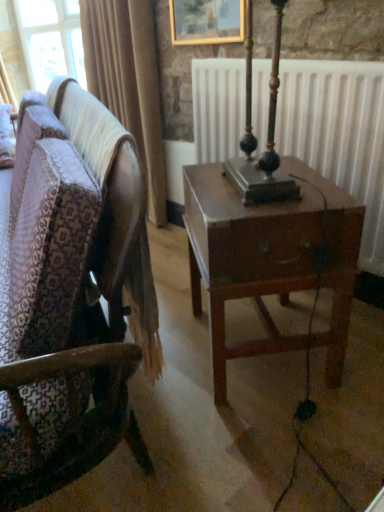
Question: Can you confirm if wooden chair at center is shorter than gold-framed painting at upper center?

Choices:
 (A) no
 (B) yes

Answer: (A)

Question: Is wooden chair at center at the left side of gold-framed painting at upper center?

Choices:
 (A) no
 (B) yes

Answer: (B)

Question: Considering the relative sizes of wooden chair at center and gold-framed painting at upper center in the image provided, is wooden chair at center bigger than gold-framed painting at upper center?

Choices:
 (A) yes
 (B) no

Answer: (A)

Question: Does wooden chair at center turn towards gold-framed painting at upper center?

Choices:
 (A) yes
 (B) no

Answer: (B)

Question: Does wooden chair at center come behind gold-framed painting at upper center?

Choices:
 (A) yes
 (B) no

Answer: (B)

Question: From the image's perspective, relative to wooden chair at center, is white matte radiator at center above or below?

Choices:
 (A) below
 (B) above

Answer: (B)

Question: In terms of width, does white matte radiator at center look wider or thinner when compared to wooden chair at center?

Choices:
 (A) thin
 (B) wide

Answer: (A)

Question: In terms of size, does white matte radiator at center appear bigger or smaller than wooden chair at center?

Choices:
 (A) small
 (B) big

Answer: (A)

Question: Would you say white matte radiator at center is to the left or to the right of wooden chair at center in the picture?

Choices:
 (A) right
 (B) left

Answer: (A)

Question: In terms of height, does gold-framed painting at upper center look taller or shorter compared to wooden chair at center?

Choices:
 (A) tall
 (B) short

Answer: (B)

Question: From a real-world perspective, is gold-framed painting at upper center above or below wooden chair at center?

Choices:
 (A) above
 (B) below

Answer: (A)

Question: Is gold-framed painting at upper center inside or outside of wooden chair at center?

Choices:
 (A) inside
 (B) outside

Answer: (B)

Question: In the image, is gold-framed painting at upper center on the left side or the right side of wooden chair at center?

Choices:
 (A) right
 (B) left

Answer: (A)

Question: From a real-world perspective, is gold-framed painting at upper center physically located above or below white matte radiator at center?

Choices:
 (A) below
 (B) above

Answer: (B)

Question: From the image's perspective, relative to white matte radiator at center, is gold-framed painting at upper center above or below?

Choices:
 (A) above
 (B) below

Answer: (A)